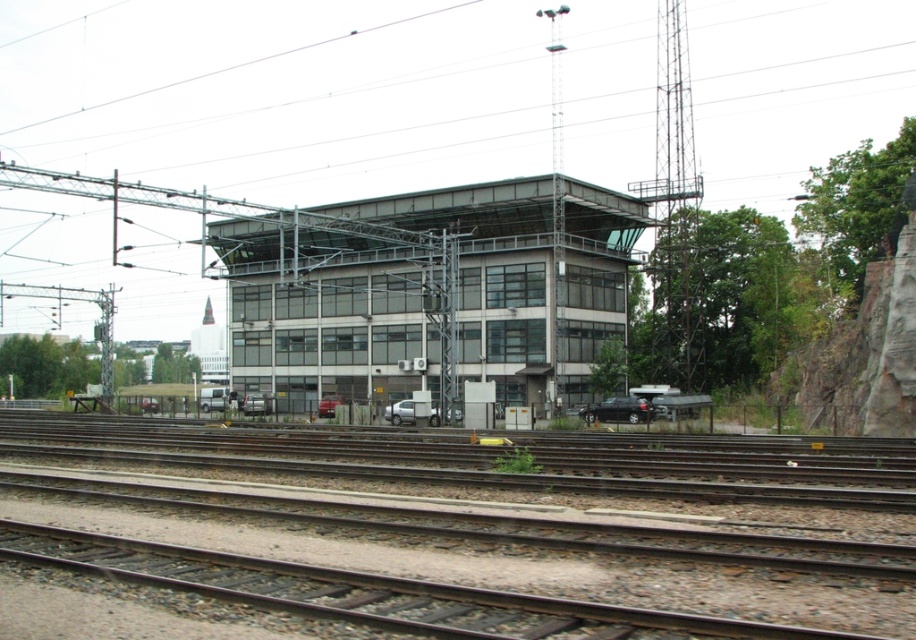
You are a construction worker who needs to place a 2 meter wide equipment between the metallic train tracks at center and the glassy steel building at center. Can you fit the equipment there?

The metallic train tracks at center is thinner than the glassy steel building at center, so the equipment may not fit as the space between them is narrower than 2 meters.

You are standing at point A located at point (72, 458). You want to walk to point B, which is 78.99 feet away from point A. Is there enough space to walk directly between the railway tracks without crossing any tracks?

The railway tracks are parallel and spaced apart, so there is enough space to walk directly between them without crossing any tracks as long as you stay within the ballast area between the tracks.

You are standing in front of the multi story building and want to take a photo of the railway tracks. You notice two points marked as point 1 at coordinates point (x=555, y=547) and point 2 at coordinates point (x=572, y=326). Which point should you focus on to ensure both the building and the tracks are in clear view?

Point 1 at coordinates point (x=555, y=547) is closer to the camera than point 2 at coordinates point (x=572, y=326). Therefore, focusing on point 1 will keep both the building and the tracks in clear view as it is nearer to the camera.